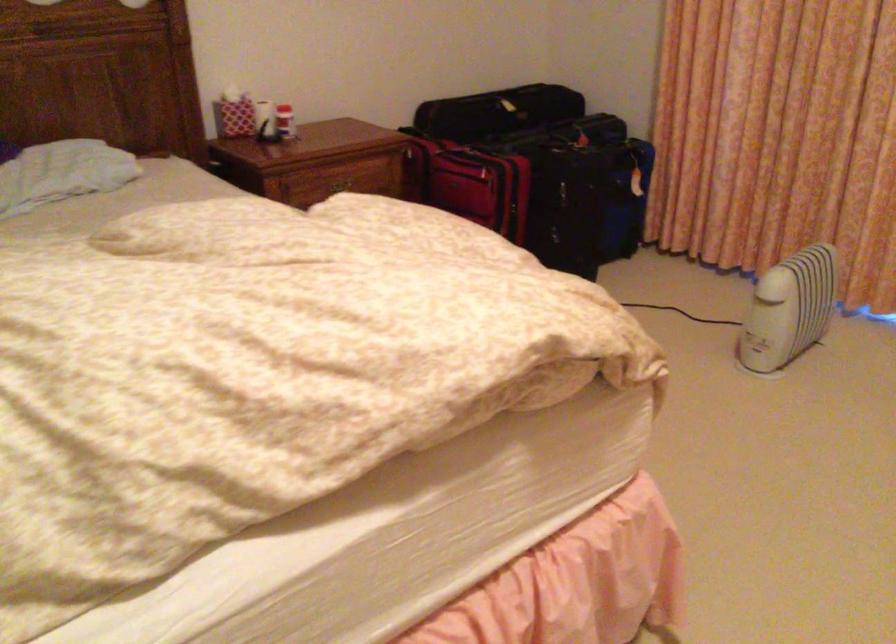
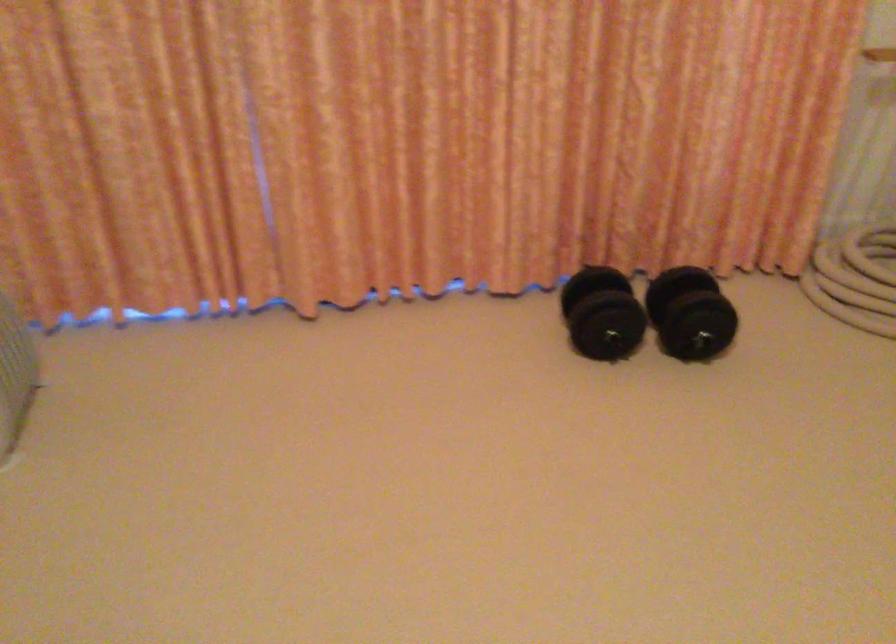
Question: The images are taken continuously from a first-person perspective. In which direction is your viewpoint rotating?

Choices:
 (A) Left
 (B) Right
 (C) Up
 (D) Down

Answer: (B)